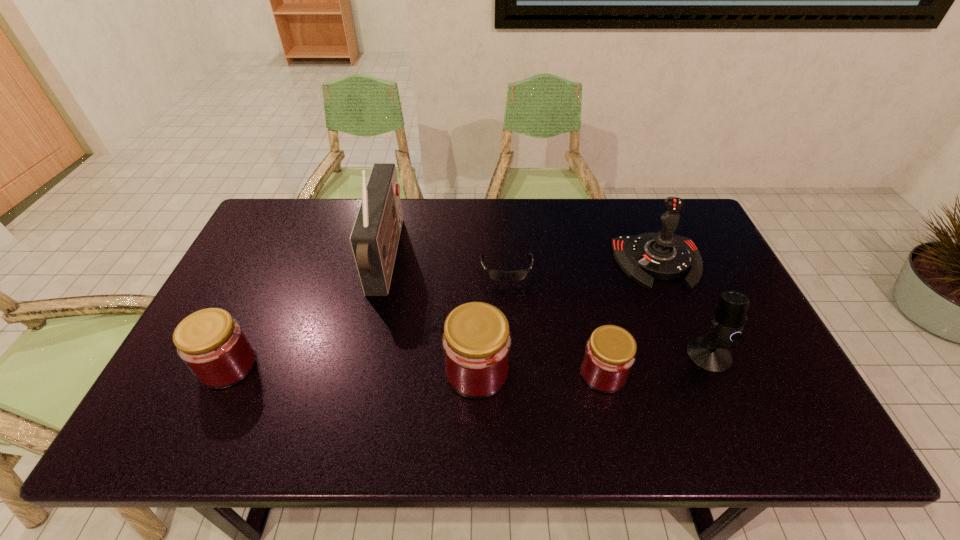
Locate an element on the screen. This screenshot has width=960, height=540. vacant region located 0.220m on the right of the second shortest jam is located at coordinates (346, 366).

Locate an element on the screen. The height and width of the screenshot is (540, 960). vacant space located on the back of the second jam from right to left is located at coordinates (477, 285).

Locate an element on the screen. The width and height of the screenshot is (960, 540). vacant region located on the left of the sixth tallest object is located at coordinates (460, 374).

Where is `vacant space located on the front panel of the second object from left to right`? This screenshot has height=540, width=960. vacant space located on the front panel of the second object from left to right is located at coordinates (513, 259).

What are the coordinates of `vacant space located 0.090m on the front-facing side of the shortest object` in the screenshot? It's located at tap(509, 309).

Locate an element on the screen. The image size is (960, 540). vacant region located on the handle side of the joystick is located at coordinates (693, 346).

Identify the location of radio receiver at the far edge. (374, 239).

At what (x,y) coordinates should I click in order to perform the action: click on joystick that is at the far edge. Please return your answer as a coordinate pair (x, y). Looking at the image, I should click on (663, 255).

Identify the location of microphone that is at the near edge. (710, 353).

You are a GUI agent. You are given a task and a screenshot of the screen. Output one action in this format:
    pyautogui.click(x=<x>, y=<y>)
    Task: Click on the object at the left edge
    
    Given the screenshot: What is the action you would take?
    click(213, 345)